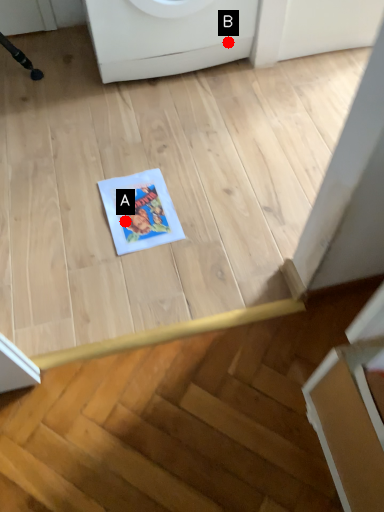
Question: Two points are circled on the image, labeled by A and B beside each circle. Which point appears closest to the camera in this image?

Choices:
 (A) A is closer
 (B) B is closer

Answer: (A)